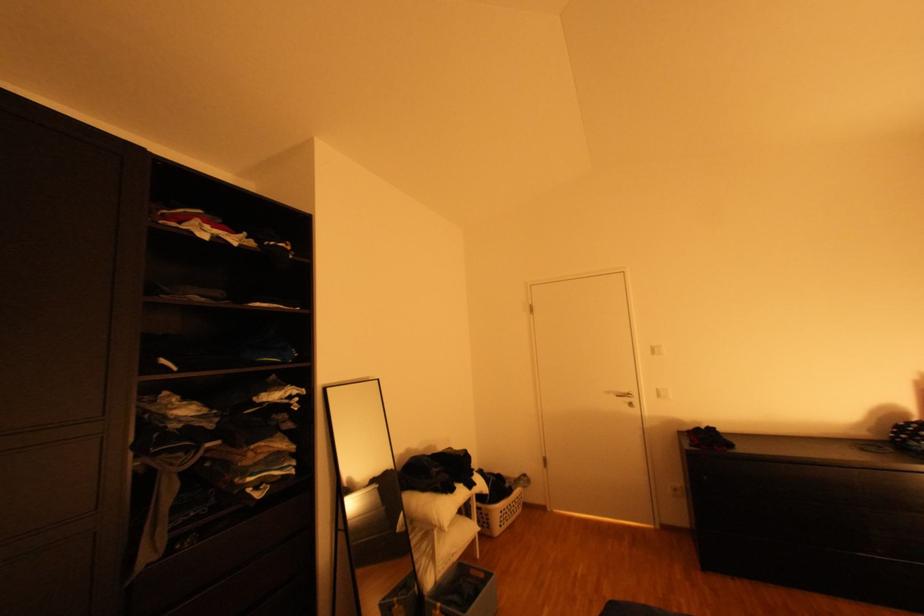
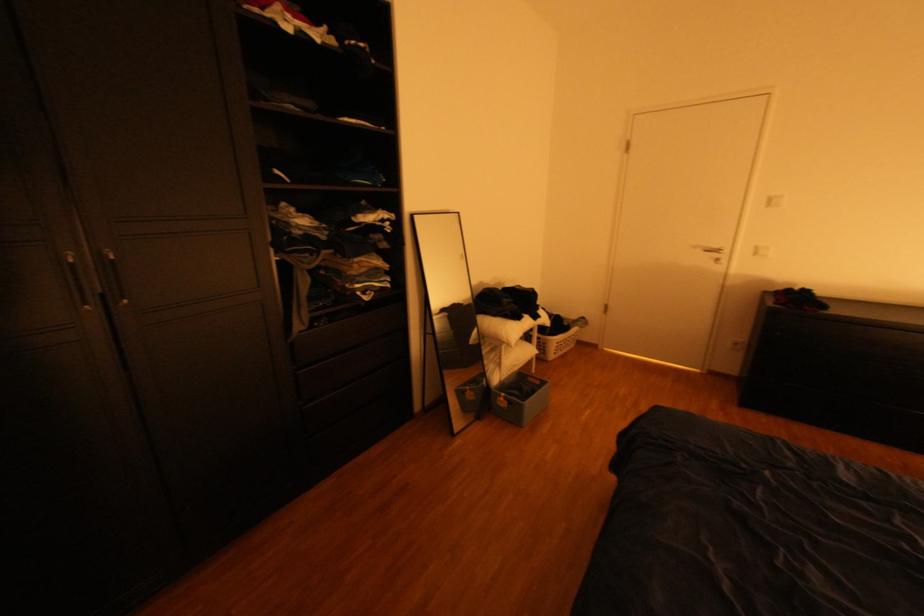
Question: How did the camera likely rotate?

Choices:
 (A) Left
 (B) Right
 (C) Up
 (D) Down

Answer: (D)